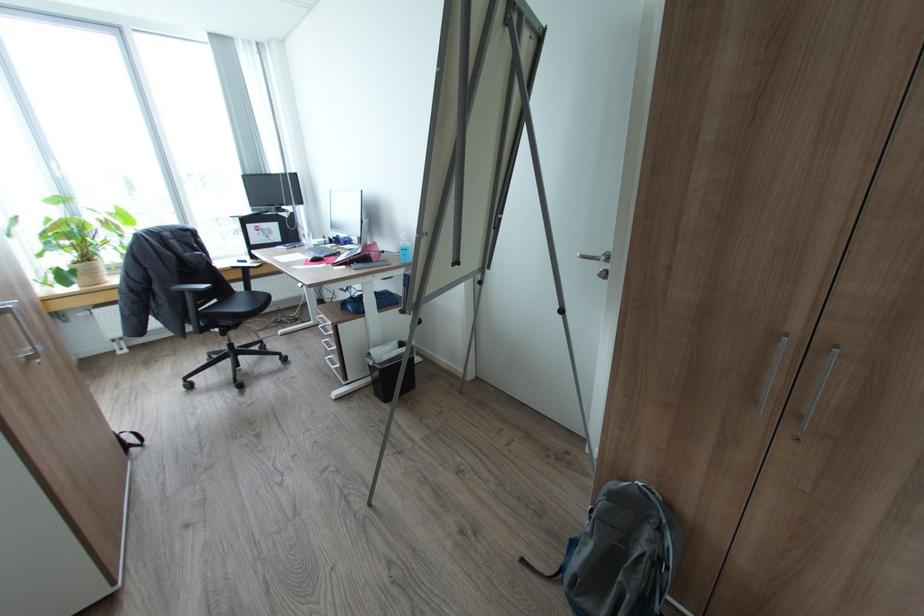
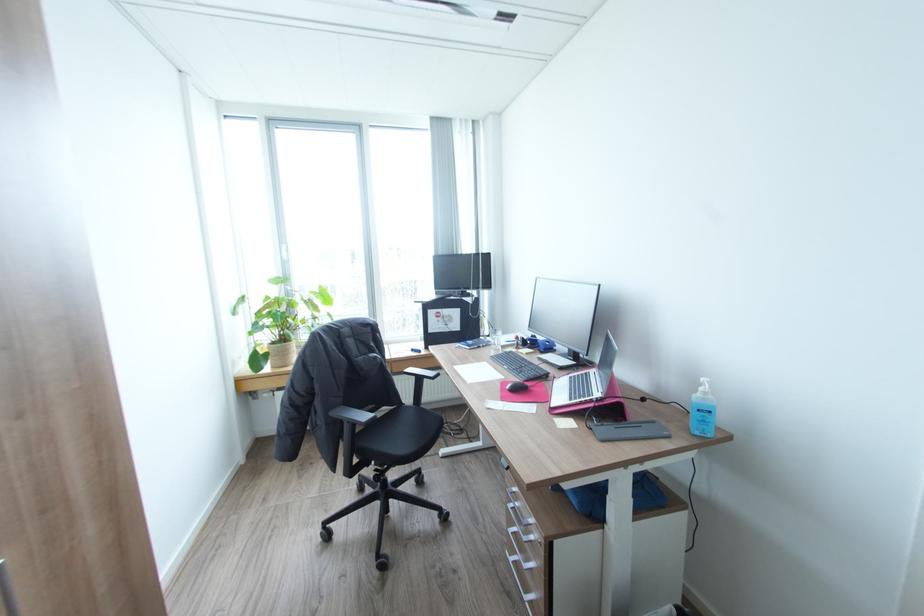
Find the pixel in the second image that matches point 359,270 in the first image.

(608, 440)